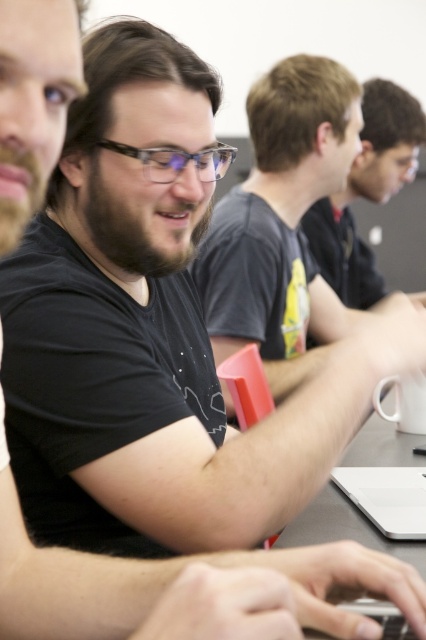
Question: Can you confirm if matte black t-shirt at center is positioned to the right of dark gray t-shirt at upper right?

Choices:
 (A) yes
 (B) no

Answer: (B)

Question: Which object appears closest to the camera in this image?

Choices:
 (A) dark gray t-shirt at upper right
 (B) matte black t-shirt at center

Answer: (B)

Question: Does matte black t-shirt at center have a lesser width compared to dark gray t-shirt at upper right?

Choices:
 (A) no
 (B) yes

Answer: (A)

Question: Where is matte black t-shirt at center located in relation to dark gray t-shirt at upper right in the image?

Choices:
 (A) left
 (B) right

Answer: (A)

Question: Which point appears farthest from the camera in this image?

Choices:
 (A) (368, 129)
 (B) (321, 164)

Answer: (A)